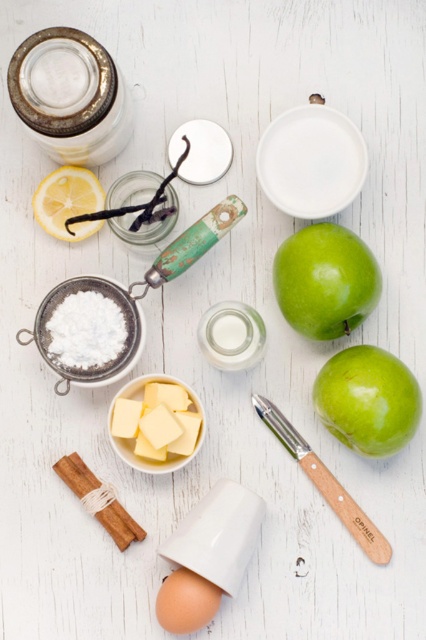
Is green matte apple at lower right thinner than brown matte egg at lower center?

No.

From the picture: Does green matte apple at lower right have a larger size compared to brown matte egg at lower center?

Yes, green matte apple at lower right is bigger than brown matte egg at lower center.

Who is more forward, (328,364) or (161,620)?

Point (161,620) is in front.

Identify the location of green matte apple at lower right. The height and width of the screenshot is (640, 426). (368, 401).

Between green matte apple at center right and wooden-handled peeler at lower center, which one has more height?

wooden-handled peeler at lower center

Measure the distance between point (328, 243) and camera.

Point (328, 243) is 83.64 centimeters away from camera.

Does point (299, 237) come in front of point (276, 420)?

That is True.

Image resolution: width=426 pixels, height=640 pixels. Find the location of `green matte apple at center right`. green matte apple at center right is located at coordinates (325, 280).

Can you confirm if yellow matte lemon at upper left is smaller than clear glass vanilla bean at center?

Correct, yellow matte lemon at upper left occupies less space than clear glass vanilla bean at center.

What are the coordinates of `yellow matte lemon at upper left` in the screenshot? It's located at (68, 202).